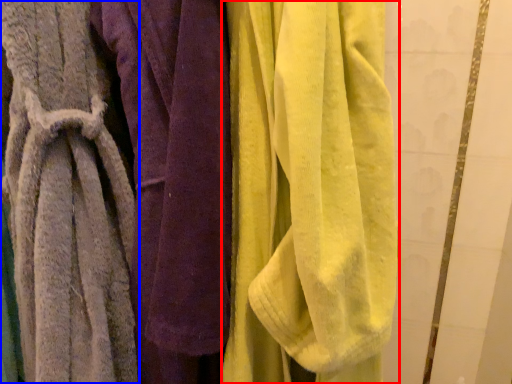
Question: Which object is further to the camera taking this photo, towel (highlighted by a red box) or towel (highlighted by a blue box)?

Choices:
 (A) towel
 (B) towel

Answer: (B)